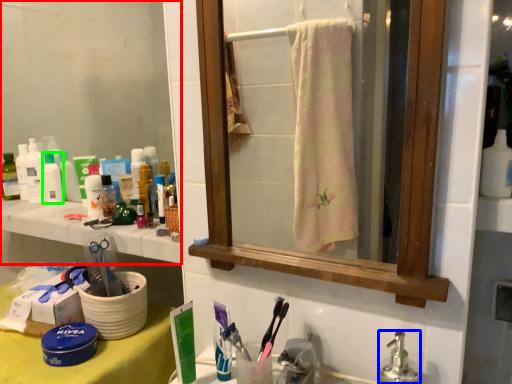
Question: Which object is positioned closest to mirror (highlighted by a red box)? Select from soap dispenser (highlighted by a blue box) and toiletry (highlighted by a green box).

Choices:
 (A) soap dispenser
 (B) toiletry

Answer: (B)